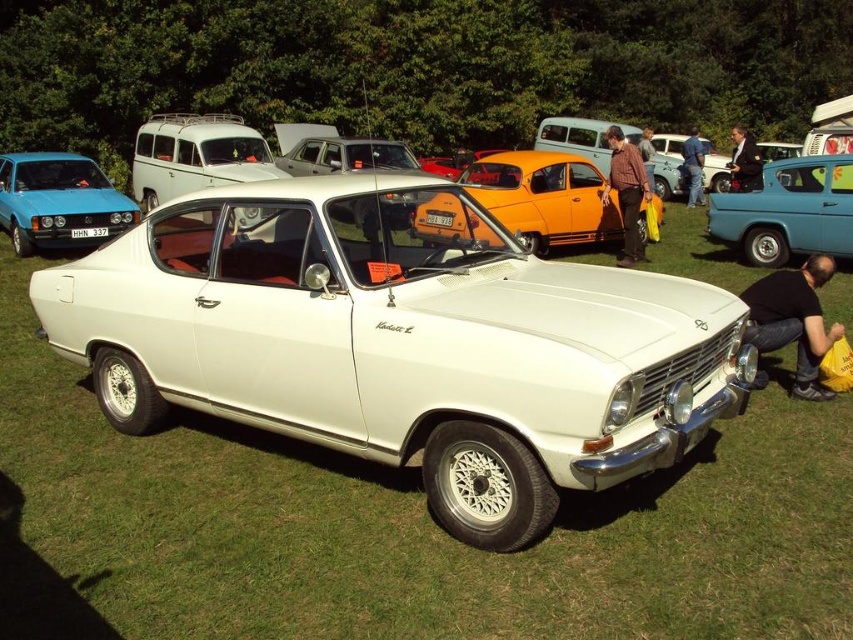
You are a photographer at the classic car event and want to take a photo of the brown shirt at center and blue jeans at lower right. Which object should you focus on first to ensure both are in focus?

The brown shirt at center is closer to the viewer than the blue jeans at lower right, so you should focus on the brown shirt at center first to ensure both are in focus.

From the picture: You are a photographer at the vintage car event. You want to capture a photo that includes both the matte blue hatchback at left and the black leather jacket at center. Based on their positions, which object should be placed lower in the frame to include both in the photo?

The matte blue hatchback at left is positioned below the black leather jacket at center, so to include both in the photo, the matte blue hatchback at left should be placed lower in the frame.